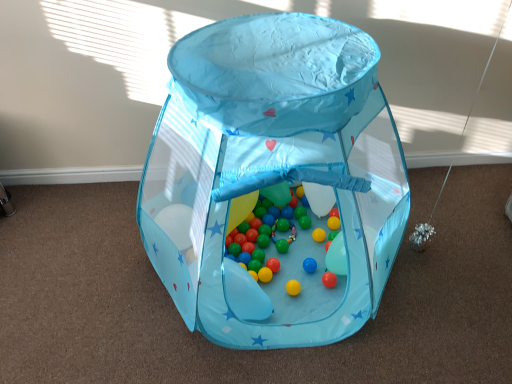
Question: In which direction should I rotate to look at multicolored glossy balls at center, positioned as the 2th toy in top-to-bottom order?

Choices:
 (A) left
 (B) right

Answer: (B)

Question: Does multicolored glossy balls at center, which ranks as the first toy in bottom-to-top order, have a greater width compared to transparent fabric play tent at center, which ranks as the second toy in bottom-to-top order?

Choices:
 (A) yes
 (B) no

Answer: (B)

Question: Could you tell me if multicolored glossy balls at center, which ranks as the first toy in bottom-to-top order, is facing transparent fabric play tent at center, which is the 1th toy in top-to-bottom order?

Choices:
 (A) no
 (B) yes

Answer: (B)

Question: Does multicolored glossy balls at center, positioned as the 2th toy in top-to-bottom order, come in front of transparent fabric play tent at center, which is the 1th toy in top-to-bottom order?

Choices:
 (A) no
 (B) yes

Answer: (A)

Question: Is multicolored glossy balls at center, which ranks as the first toy in bottom-to-top order, with transparent fabric play tent at center, which is the 1th toy in top-to-bottom order?

Choices:
 (A) no
 (B) yes

Answer: (A)

Question: Can you confirm if multicolored glossy balls at center, which ranks as the first toy in bottom-to-top order, is taller than transparent fabric play tent at center, which is the 1th toy in top-to-bottom order?

Choices:
 (A) no
 (B) yes

Answer: (A)

Question: Is multicolored glossy balls at center, positioned as the 2th toy in top-to-bottom order, located outside transparent fabric play tent at center, which is the 1th toy in top-to-bottom order?

Choices:
 (A) yes
 (B) no

Answer: (B)

Question: Considering the relative sizes of transparent fabric play tent at center, which is the 1th toy in top-to-bottom order, and multicolored glossy balls at center, which ranks as the first toy in bottom-to-top order, in the image provided, is transparent fabric play tent at center, which is the 1th toy in top-to-bottom order, shorter than multicolored glossy balls at center, which ranks as the first toy in bottom-to-top order,?

Choices:
 (A) no
 (B) yes

Answer: (A)

Question: Is transparent fabric play tent at center, which is the 1th toy in top-to-bottom order, wider than multicolored glossy balls at center, which ranks as the first toy in bottom-to-top order?

Choices:
 (A) yes
 (B) no

Answer: (A)

Question: Is transparent fabric play tent at center, which is the 1th toy in top-to-bottom order, at the right side of multicolored glossy balls at center, which ranks as the first toy in bottom-to-top order?

Choices:
 (A) no
 (B) yes

Answer: (A)

Question: Is multicolored glossy balls at center, positioned as the 2th toy in top-to-bottom order, located within transparent fabric play tent at center, which is the 1th toy in top-to-bottom order?

Choices:
 (A) yes
 (B) no

Answer: (A)

Question: Does transparent fabric play tent at center, which ranks as the second toy in bottom-to-top order, have a lesser width compared to multicolored glossy balls at center, which ranks as the first toy in bottom-to-top order?

Choices:
 (A) yes
 (B) no

Answer: (B)

Question: Can you confirm if transparent fabric play tent at center, which is the 1th toy in top-to-bottom order, is smaller than multicolored glossy balls at center, which ranks as the first toy in bottom-to-top order?

Choices:
 (A) yes
 (B) no

Answer: (B)

Question: From a real-world perspective, is transparent fabric play tent at center, which is the 1th toy in top-to-bottom order, positioned under translucent plastic balloon at center based on gravity?

Choices:
 (A) yes
 (B) no

Answer: (B)